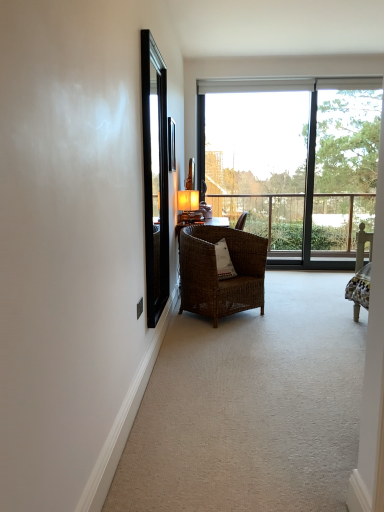
The image size is (384, 512). Find the location of `free spot to the right of woven brown chair at center`. free spot to the right of woven brown chair at center is located at coordinates (296, 313).